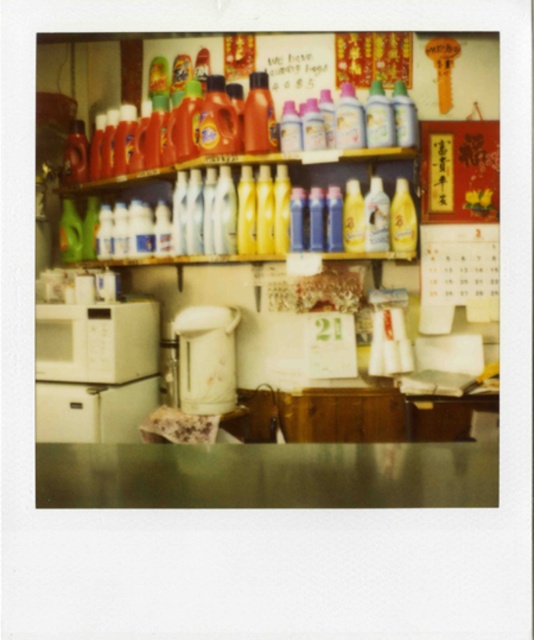
You are a customer in the store and want to pick up both the white glossy electric kettle at center and the translucent plastic bottles at upper center. Which item will you need to reach for first?

You will need to reach for the white glossy electric kettle at center first because it is closer to you than the translucent plastic bottles at upper center, which are further away.

You are a customer in a store and you see two points marked on the wall. The first point is at coordinate point (x=172, y=122) and the second is at point (x=265, y=168). Which point is closer to you?

Point (x=172, y=122) is further to the camera than point (x=265, y=168), so the second point is closer to you.